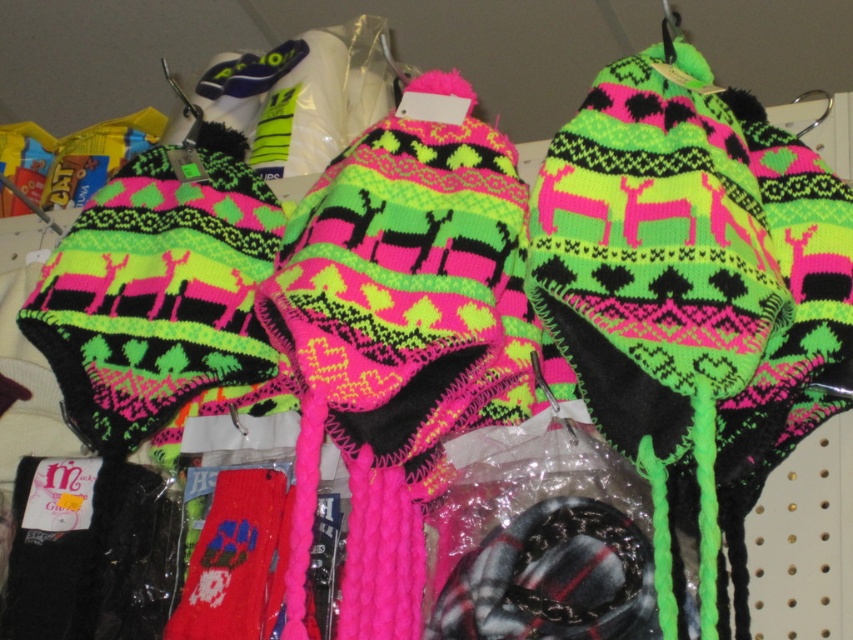
You are a customer in a store looking at the neon pink knitted sock at center and the knitted wool socks at center. Which one is positioned to the right?

The neon pink knitted sock at center is positioned to the right of the knitted wool socks at center.

You are a customer trying to choose between the neon pink knitted sock at center and the knitted wool socks at center. Which one has a wider width?

The neon pink knitted sock at center might be wider than the knitted wool socks at center.